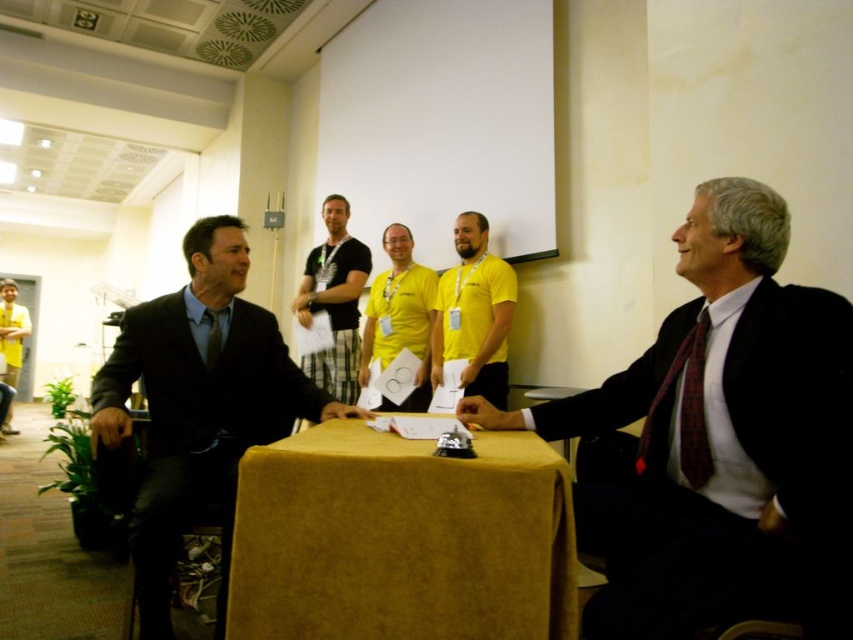
Does matte black suit at center have a smaller size compared to yellow t-shirt at center?

Yes.

Which is more to the left, matte black suit at center or yellow t-shirt at center?

yellow t-shirt at center is more to the left.

In order to click on matte black suit at center in this screenshot , I will do [718, 444].

Locate an element on the screen. This screenshot has width=853, height=640. matte black suit at center is located at coordinates (718, 444).

Is black t-shirt at center wider than yellow matte shirt at center?

Yes, black t-shirt at center is wider than yellow matte shirt at center.

Between black t-shirt at center and yellow matte shirt at center, which one has less height?

With less height is yellow matte shirt at center.

Is point (312, 304) farther from camera compared to point (413, 394)?

Yes, point (312, 304) is farther from viewer.

Identify the location of black t-shirt at center. (334, 301).

Does black suit at left have a lesser height compared to yellow fabric shirt at center?

No.

Is black suit at left closer to camera compared to yellow fabric shirt at center?

Yes, black suit at left is closer to the viewer.

Is point (257, 396) farther from viewer compared to point (483, 388)?

No, it is not.

Locate an element on the screen. The width and height of the screenshot is (853, 640). black suit at left is located at coordinates (198, 406).